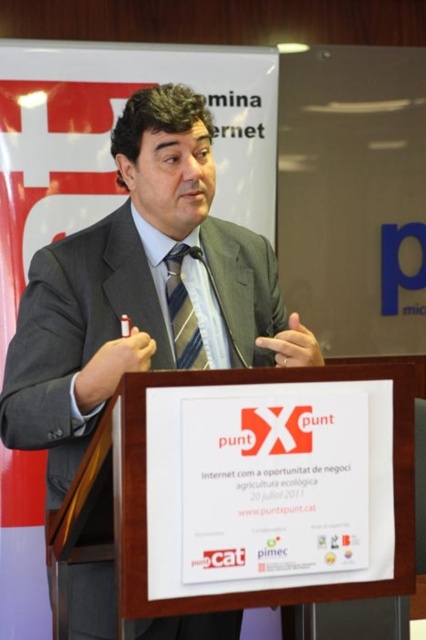
Based on the scene description, what are the coordinates of the gray suit at center?

The gray suit at center is located at coordinates point [140,289].

You are a fashion designer observing a man in a presentation. The man is wearing a gray suit at center and a striped fabric tie at center. Which clothing item is wider?

The gray suit at center is wider than the striped fabric tie at center.